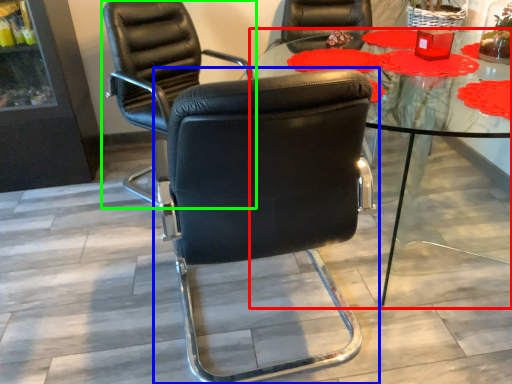
Question: Based on their relative distances, which object is nearer to table (highlighted by a red box)? Choose from chair (highlighted by a blue box) and chair (highlighted by a green box).

Choices:
 (A) chair
 (B) chair

Answer: (A)